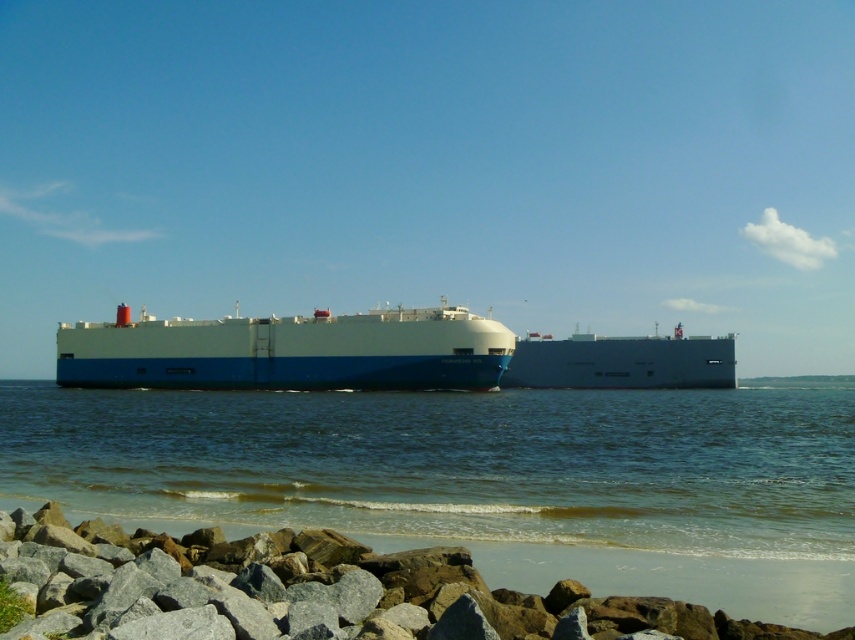
Question: Is blue matte cargo ship at center thinner than white matte ship at center?

Choices:
 (A) yes
 (B) no

Answer: (A)

Question: Is blue water at center smaller than white matte ship at center?

Choices:
 (A) yes
 (B) no

Answer: (A)

Question: Among these points, which one is nearest to the camera?

Choices:
 (A) (635, 364)
 (B) (852, 538)

Answer: (B)

Question: Is the position of blue matte cargo ship at center more distant than that of white matte ship at center?

Choices:
 (A) no
 (B) yes

Answer: (A)

Question: Which point appears closest to the camera in this image?

Choices:
 (A) (538, 369)
 (B) (502, 353)

Answer: (B)

Question: Which object is farther from the camera taking this photo?

Choices:
 (A) white matte ship at center
 (B) blue water at center

Answer: (A)